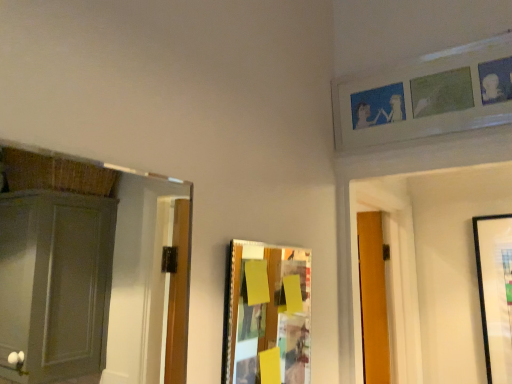
Question: Is white matte picture frame at upper right, which is counted as the 2th picture frame, starting from the left, facing towards wooden collage board at center, marked as the first picture frame in a front-to-back arrangement?

Choices:
 (A) yes
 (B) no

Answer: (B)

Question: Considering the relative positions of white matte picture frame at upper right, arranged as the first picture frame when viewed from the right, and wooden collage board at center, the first picture frame when ordered from left to right, in the image provided, is white matte picture frame at upper right, arranged as the first picture frame when viewed from the right, in front of wooden collage board at center, the first picture frame when ordered from left to right,?

Choices:
 (A) yes
 (B) no

Answer: (B)

Question: Is white matte picture frame at upper right, marked as the 2th picture frame in a front-to-back arrangement, not close to wooden collage board at center, the second picture frame from the back?

Choices:
 (A) no
 (B) yes

Answer: (A)

Question: From a real-world perspective, is white matte picture frame at upper right, marked as the first picture frame in a top-to-bottom arrangement, positioned under wooden collage board at center, which ranks as the 2th picture frame in right-to-left order, based on gravity?

Choices:
 (A) yes
 (B) no

Answer: (B)

Question: From the image's perspective, is white matte picture frame at upper right, arranged as the first picture frame when viewed from the right, below wooden collage board at center, marked as the first picture frame in a front-to-back arrangement?

Choices:
 (A) no
 (B) yes

Answer: (A)

Question: Is white matte picture frame at upper right, marked as the 2th picture frame in a front-to-back arrangement, directly adjacent to wooden collage board at center, the first picture frame when ordered from left to right?

Choices:
 (A) yes
 (B) no

Answer: (B)

Question: Does wooden collage board at center, which ranks as the 2th picture frame in right-to-left order, lie behind white matte picture frame at upper right, arranged as the first picture frame when viewed from the right?

Choices:
 (A) no
 (B) yes

Answer: (A)

Question: Are wooden collage board at center, which ranks as the 2th picture frame in right-to-left order, and white matte picture frame at upper right, positioned as the 1th picture frame in back-to-front order, making contact?

Choices:
 (A) no
 (B) yes

Answer: (A)

Question: Is wooden collage board at center, the second picture frame from the back, to the right of white matte picture frame at upper right, marked as the first picture frame in a top-to-bottom arrangement, from the viewer's perspective?

Choices:
 (A) yes
 (B) no

Answer: (B)

Question: Is wooden collage board at center, the 2th picture frame positioned from the top, thinner than white matte picture frame at upper right, placed as the 2th picture frame when sorted from bottom to top?

Choices:
 (A) yes
 (B) no

Answer: (A)

Question: Is wooden collage board at center, marked as the first picture frame in a front-to-back arrangement, facing towards white matte picture frame at upper right, which is counted as the 2th picture frame, starting from the left?

Choices:
 (A) no
 (B) yes

Answer: (A)

Question: Does wooden collage board at center, the first picture frame when ordered from left to right, have a greater height compared to white matte picture frame at upper right, positioned as the 1th picture frame in back-to-front order?

Choices:
 (A) yes
 (B) no

Answer: (A)

Question: From the image's perspective, relative to wooden collage board at center, marked as the first picture frame in a front-to-back arrangement, is white matte picture frame at upper right, marked as the first picture frame in a top-to-bottom arrangement, above or below?

Choices:
 (A) below
 (B) above

Answer: (B)